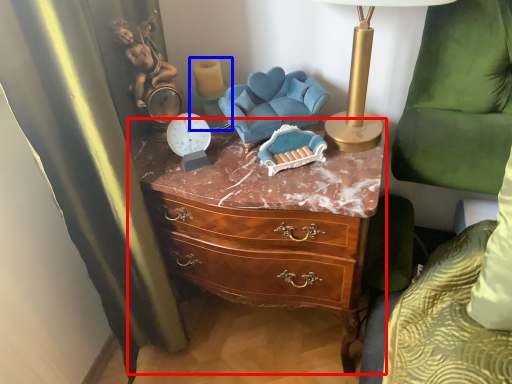
Question: Which object appears closest to the camera in this image, chest of drawers (highlighted by a red box) or candle holder (highlighted by a blue box)?

Choices:
 (A) chest of drawers
 (B) candle holder

Answer: (A)